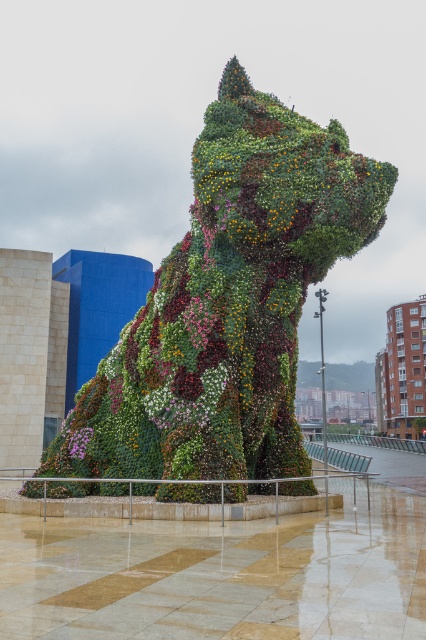
Which of these two, floral greenery dog at center or pink matte flower at center, stands shorter?

With less height is pink matte flower at center.

Can you confirm if floral greenery dog at center is positioned below pink matte flower at center?

Incorrect, floral greenery dog at center is not positioned below pink matte flower at center.

What do you see at coordinates (230, 301) in the screenshot? I see `floral greenery dog at center` at bounding box center [230, 301].

Where is `floral greenery dog at center`? This screenshot has width=426, height=640. floral greenery dog at center is located at coordinates point(230,301).